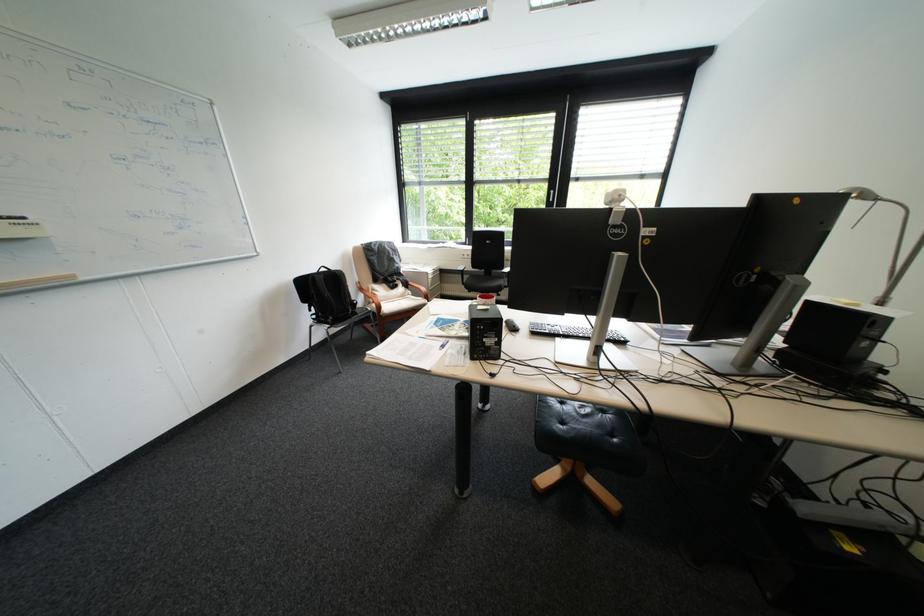
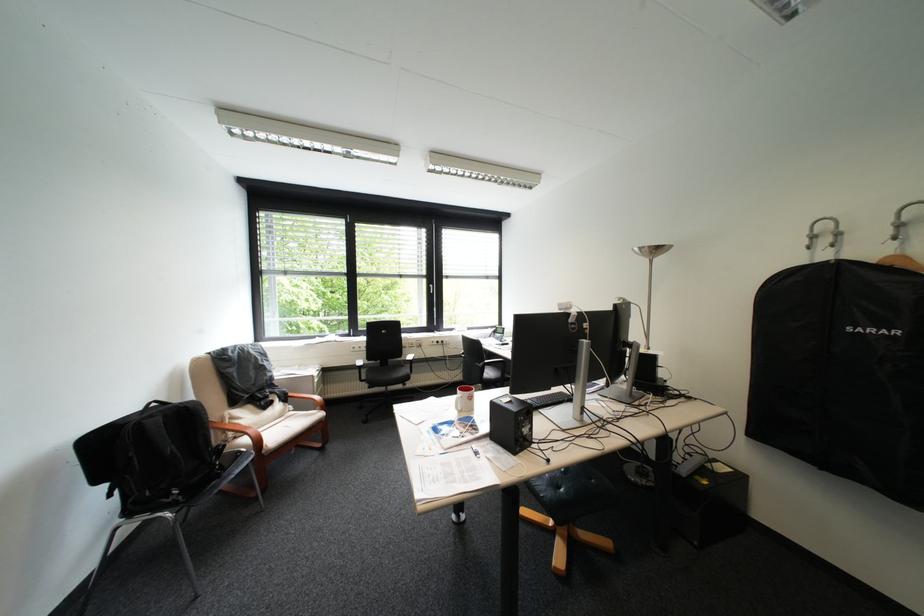
Where in the second image is the point corresponding to (x=347, y=273) from the first image?

(199, 407)